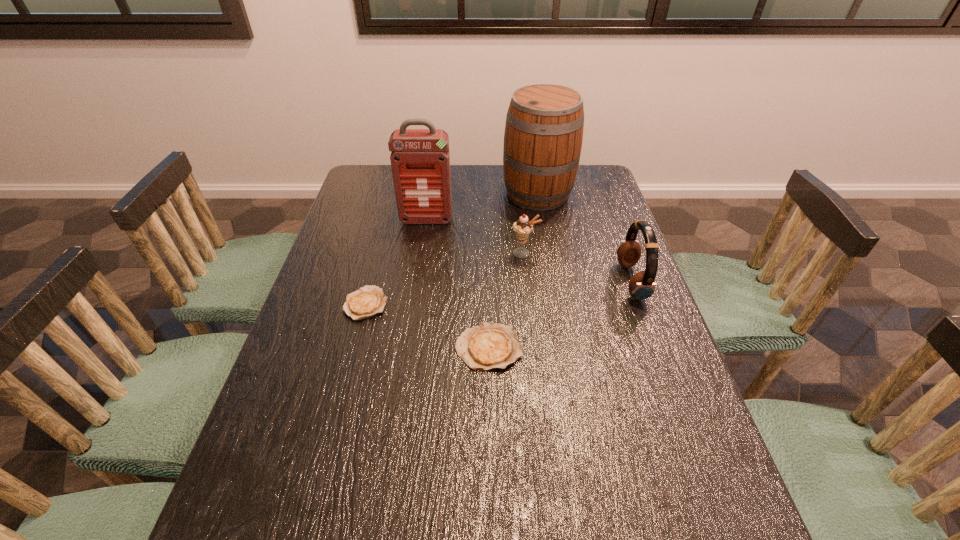
The image size is (960, 540). I want to click on the farther quiche, so click(368, 301).

The height and width of the screenshot is (540, 960). Identify the location of the left quiche. (368, 301).

Locate an element on the screen. the fifth tallest object is located at coordinates (488, 346).

Find the location of a particular element. This screenshot has height=540, width=960. the taller quiche is located at coordinates (488, 346).

In order to click on the first-aid kit in this screenshot , I will do `click(420, 160)`.

I want to click on the farthest object, so click(543, 136).

You are a GUI agent. You are given a task and a screenshot of the screen. Output one action in this format:
    pyautogui.click(x=<x>, y=<y>)
    Task: Click on the rightmost object
    The height and width of the screenshot is (540, 960).
    Given the screenshot: What is the action you would take?
    pyautogui.click(x=642, y=285)

Identify the location of the third shortest object. The image size is (960, 540). (523, 227).

Locate an element on the screen. This screenshot has height=540, width=960. vacant area situated on the right of the shortest object is located at coordinates (433, 303).

Locate an element on the screen. This screenshot has height=540, width=960. vacant area situated on the back of the nearer quiche is located at coordinates [487, 255].